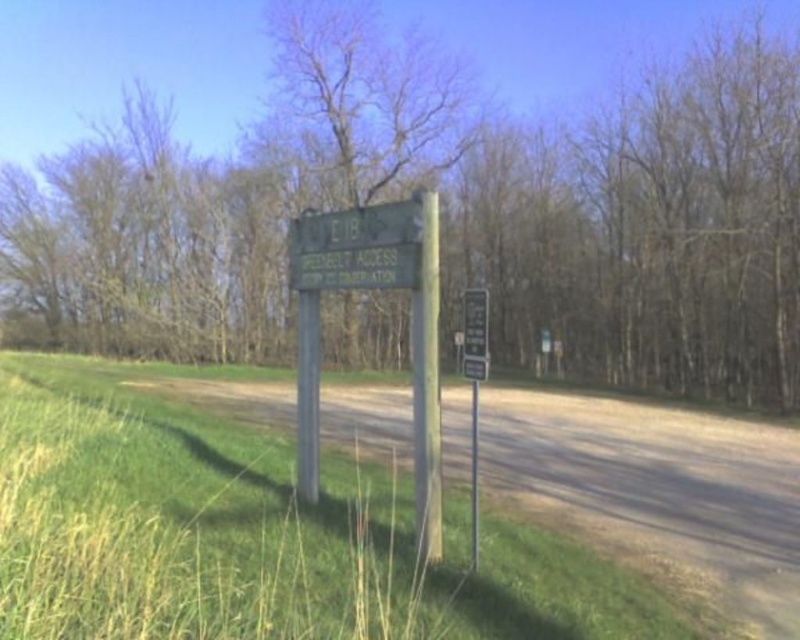
You are standing at the edge of the dirt road and notice the green grass at lower left and the wooden post at center. Which of these two objects appears bigger in the image?

The green grass at lower left appears bigger than the wooden post at center because it has a larger size compared to it.

You are standing at the edge of the dirt road and see the green grass at lower left and the wooden post at center. Which of these two objects is located to the left of the other?

The green grass at lower left is positioned on the left side of wooden post at center.